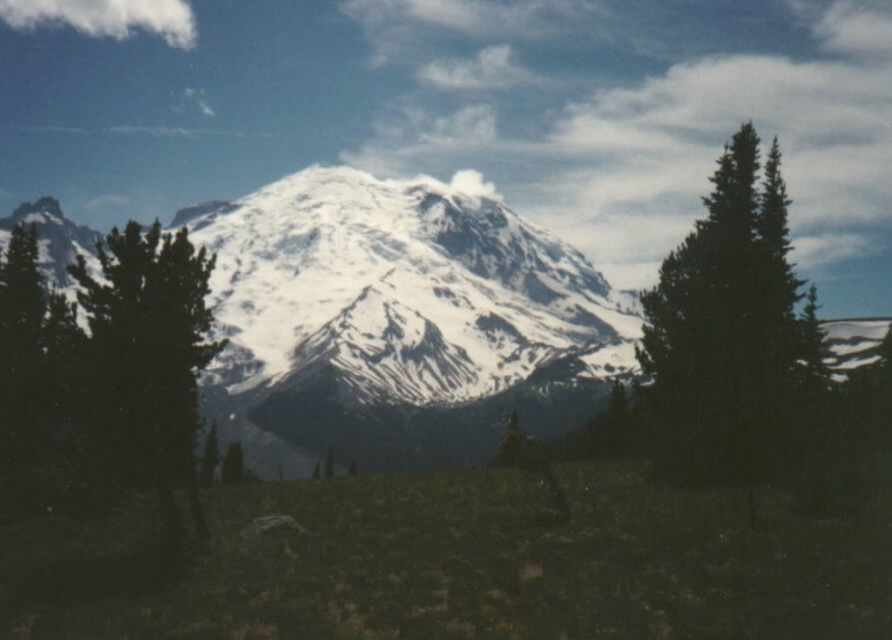
Question: Which of the following is the closest to the observer?

Choices:
 (A) (227, 362)
 (B) (781, 211)

Answer: (B)

Question: Which point is closer to the camera?

Choices:
 (A) (783, 276)
 (B) (120, 369)
 (C) (277, 298)

Answer: (B)

Question: In this image, where is green matte tree at left located relative to green textured pine tree at right?

Choices:
 (A) left
 (B) right

Answer: (A)

Question: Among these points, which one is nearest to the camera?

Choices:
 (A) (145, 384)
 (B) (709, 416)
 (C) (298, 406)

Answer: (A)

Question: Can you confirm if white snow-covered mountain at center is bigger than green matte tree at left?

Choices:
 (A) yes
 (B) no

Answer: (A)

Question: Does white snow-covered mountain at center have a smaller size compared to green matte tree at left?

Choices:
 (A) yes
 (B) no

Answer: (B)